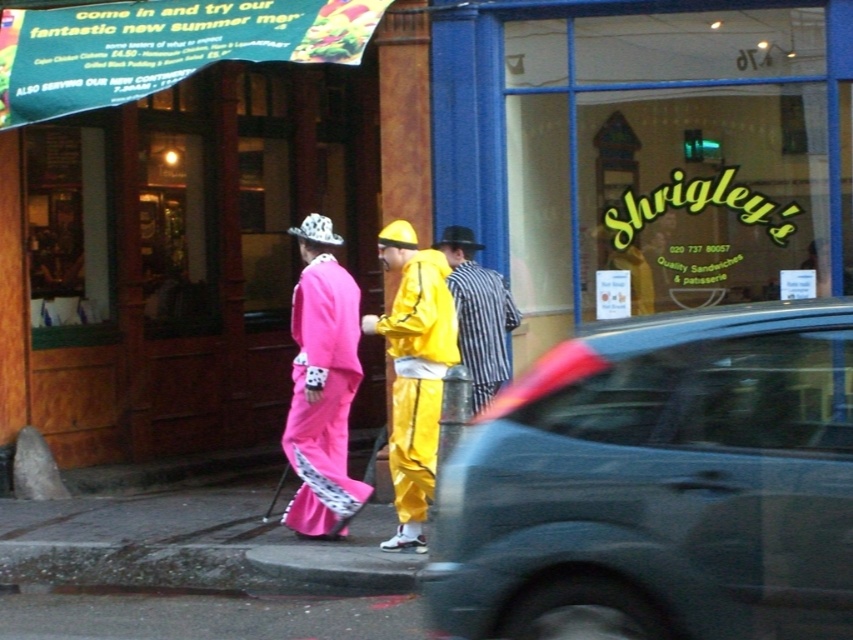
Question: Among these points, which one is nearest to the camera?

Choices:
 (A) (505, 333)
 (B) (614, 326)
 (C) (357, 492)

Answer: (B)

Question: Does matte yellow jumpsuit at center appear over striped fabric shirt at center?

Choices:
 (A) no
 (B) yes

Answer: (A)

Question: Is pink satin kimono at center closer to the viewer compared to striped fabric shirt at center?

Choices:
 (A) no
 (B) yes

Answer: (B)

Question: Which point is closer to the camera?

Choices:
 (A) matte yellow jumpsuit at center
 (B) pink satin kimono at center
 (C) metallic gray car at center

Answer: (C)

Question: Is rubberized yellow raincoat at center to the right of striped fabric shirt at center from the viewer's perspective?

Choices:
 (A) yes
 (B) no

Answer: (B)

Question: Which point is farther from the camera taking this photo?

Choices:
 (A) (480, 300)
 (B) (293, 400)
 (C) (428, 314)
 (D) (410, 326)

Answer: (A)